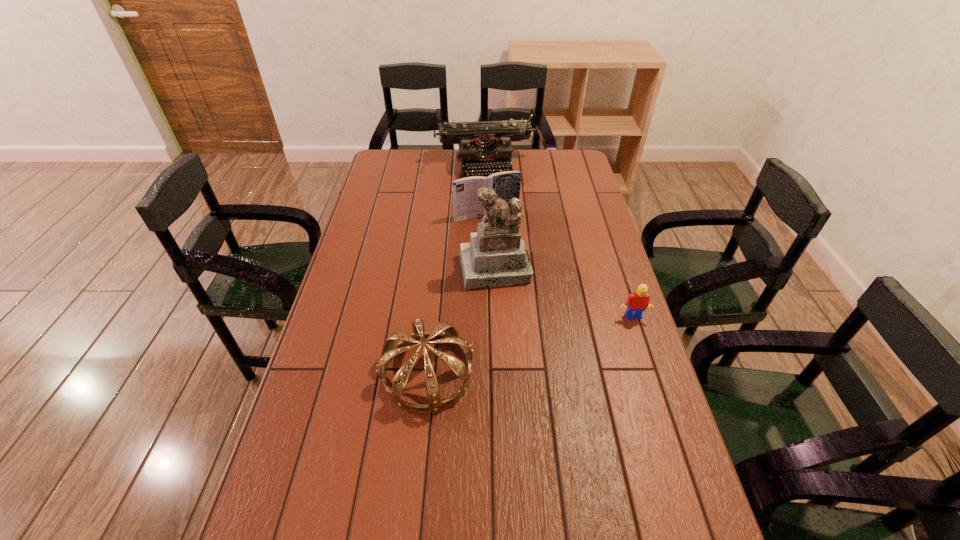
Identify the location of vacant space on the desktop that is between the tiara and the rightmost object and is positioned on the front cover of the book. The image size is (960, 540). (548, 340).

Identify the location of free space on the desktop that is between the tiara and the shortest object and is positioned on the front-facing side of the third farthest object. (512, 350).

You are a GUI agent. You are given a task and a screenshot of the screen. Output one action in this format:
    pyautogui.click(x=<x>, y=<y>)
    Task: Click on the vacant spot on the desktop that is between the tiara and the second nearest object and is positioned on the keyboard of the typewriter
    Image resolution: width=960 pixels, height=540 pixels.
    Given the screenshot: What is the action you would take?
    pyautogui.click(x=531, y=345)